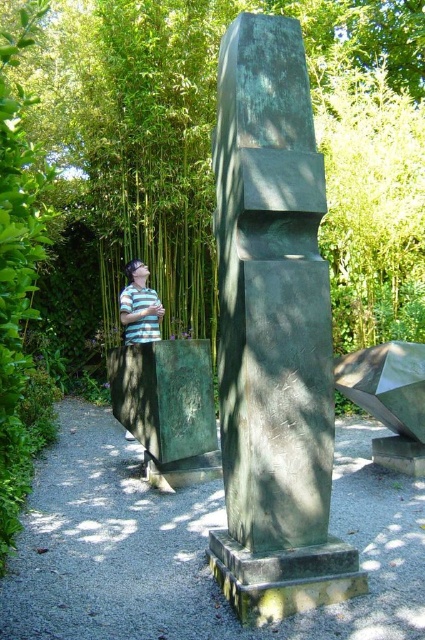
Question: From the image, what is the correct spatial relationship of green stone sculpture at center in relation to striped shirt at lower left?

Choices:
 (A) below
 (B) above

Answer: (A)

Question: Which is nearer to the green stone sculpture at center?

Choices:
 (A) gray gravel path at center
 (B) striped shirt at lower left

Answer: (A)

Question: Considering the real-world distances, which object is farthest from the green stone sculpture at center?

Choices:
 (A) gray gravel path at center
 (B) striped shirt at lower left

Answer: (B)

Question: Is green stone sculpture at center above gray gravel path at center?

Choices:
 (A) yes
 (B) no

Answer: (A)

Question: Which object appears closest to the camera in this image?

Choices:
 (A) gray gravel path at center
 (B) striped shirt at lower left
 (C) green stone sculpture at center

Answer: (A)

Question: Is green stone sculpture at center to the left of gray gravel path at center from the viewer's perspective?

Choices:
 (A) yes
 (B) no

Answer: (B)